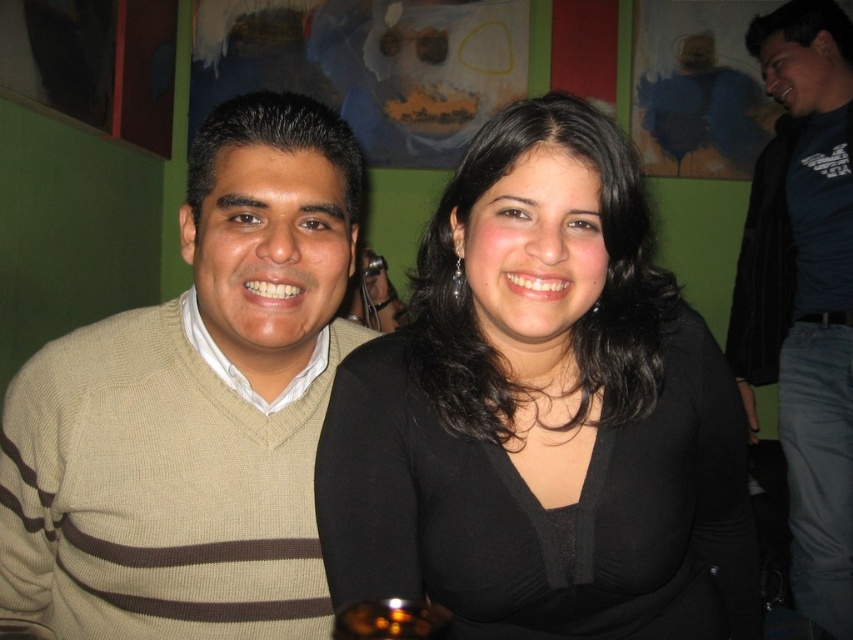
You are a photographer trying to capture a clear shot of both the black matte shirt at center and the dark blue shirt at right. Based on their positions, which one is closer to the camera?

The black matte shirt at center is closer to the camera because it is in front of the dark blue shirt at right.

You are a photographer trying to capture the black matte shirt at center in the image. The camera is set to focus on the point at coordinates point (x=543, y=413). Is this point likely to be on the black matte shirt at center?

Yes, the point (x=543, y=413) corresponds to the black matte shirt at center, so the focus is correctly placed on the black matte shirt at center.